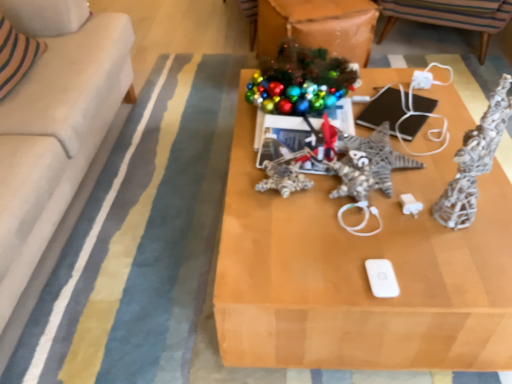
I want to click on blank space above wooden table at center (from a real-world perspective), so [374, 181].